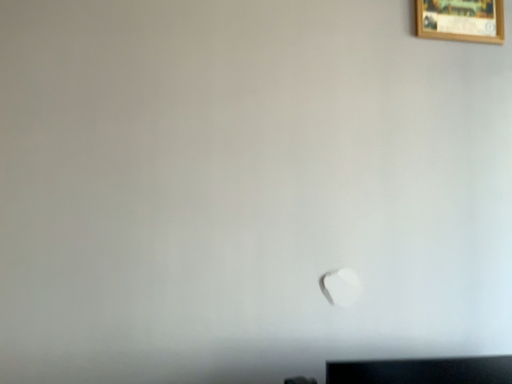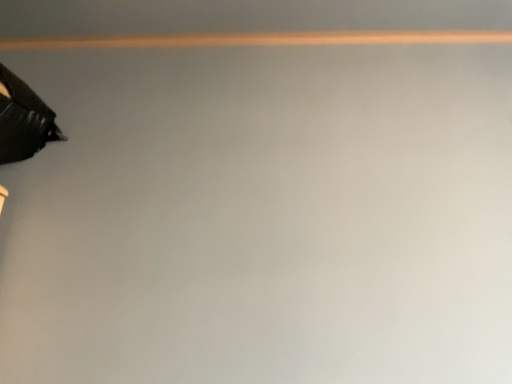
Question: Which way did the camera rotate in the video?

Choices:
 (A) rotated right
 (B) rotated left

Answer: (B)